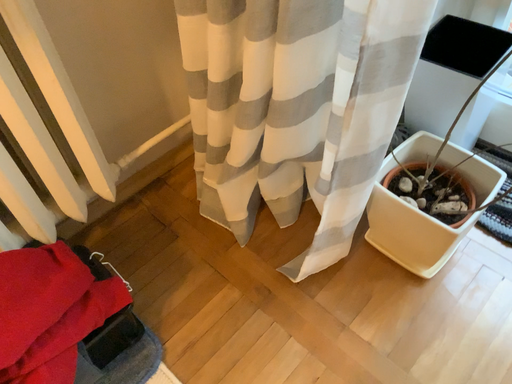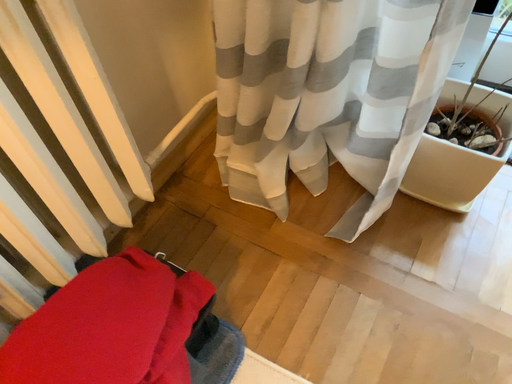
Question: Which way did the camera rotate in the video?

Choices:
 (A) rotated left
 (B) rotated right

Answer: (B)